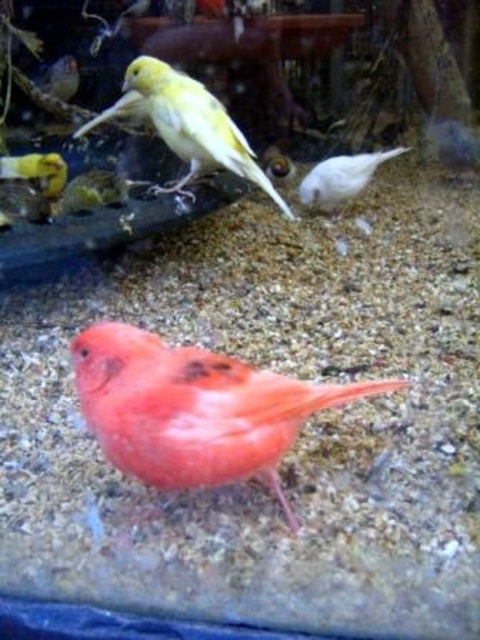
Is yellow matte canary at upper center below white matte bird at center?

Incorrect, yellow matte canary at upper center is not positioned below white matte bird at center.

Can you confirm if yellow matte canary at upper center is wider than white matte bird at center?

Yes.

This screenshot has height=640, width=480. Describe the element at coordinates (187, 124) in the screenshot. I see `yellow matte canary at upper center` at that location.

Where is `yellow matte canary at upper center`? This screenshot has height=640, width=480. yellow matte canary at upper center is located at coordinates (187, 124).

The image size is (480, 640). What do you see at coordinates (193, 410) in the screenshot? I see `matte orange bird at center` at bounding box center [193, 410].

Does point (285, 444) come in front of point (140, 109)?

Yes.

This screenshot has height=640, width=480. Describe the element at coordinates (193, 410) in the screenshot. I see `matte orange bird at center` at that location.

This screenshot has width=480, height=640. I want to click on matte orange bird at center, so click(193, 410).

Does matte orange bird at center have a larger size compared to white matte bird at center?

Incorrect, matte orange bird at center is not larger than white matte bird at center.

Between matte orange bird at center and white matte bird at center, which one is positioned higher?

white matte bird at center is higher up.

Who is more distant from viewer, (222,452) or (364,179)?

Point (364,179)

Find the location of a particular element. matte orange bird at center is located at coordinates (193, 410).